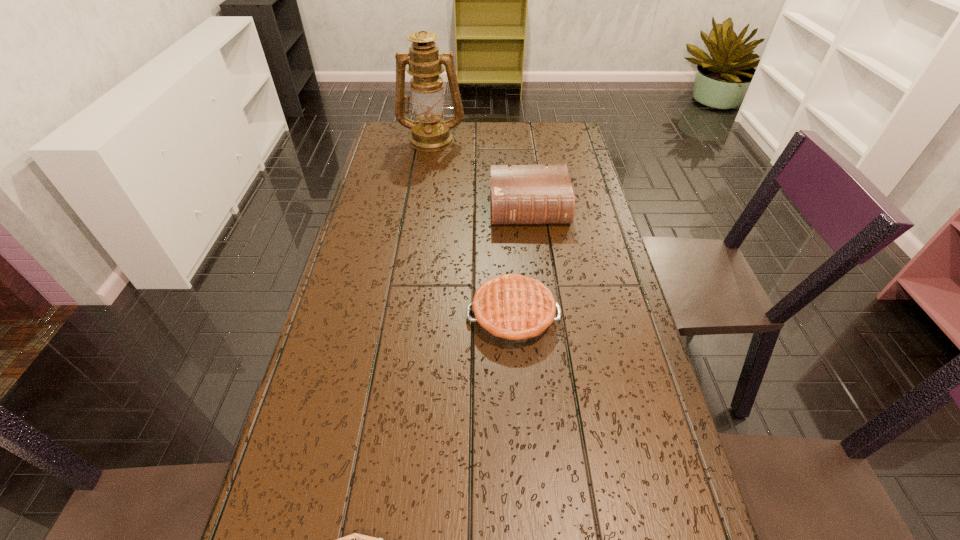
At what (x,y) coordinates should I click in order to perform the action: click on object that is at the left edge. Please return your answer as a coordinate pair (x, y). Looking at the image, I should click on (430, 133).

Locate an element on the screen. object located in the right edge section of the desktop is located at coordinates (520, 194).

Locate an element on the screen. object positioned at the far left corner is located at coordinates (430, 133).

Where is `blank space at the far edge of the desktop`? This screenshot has height=540, width=960. blank space at the far edge of the desktop is located at coordinates (493, 152).

The height and width of the screenshot is (540, 960). Identify the location of free space at the left edge of the desktop. (x=415, y=174).

At what (x,y) coordinates should I click in order to perform the action: click on vacant area at the right edge of the desktop. Please return your answer as a coordinate pair (x, y). The height and width of the screenshot is (540, 960). Looking at the image, I should click on (593, 340).

You are a GUI agent. You are given a task and a screenshot of the screen. Output one action in this format:
    pyautogui.click(x=<x>, y=<y>)
    Task: Click on the vacant space at the far right corner of the desktop
    
    Given the screenshot: What is the action you would take?
    pyautogui.click(x=536, y=129)

The width and height of the screenshot is (960, 540). Identify the location of empty space that is in between the farthest object and the third tallest object. (472, 227).

You are a GUI agent. You are given a task and a screenshot of the screen. Output one action in this format:
    pyautogui.click(x=<x>, y=<y>)
    Task: Click on the free spot between the third farthest object and the farthest object
    
    Given the screenshot: What is the action you would take?
    pyautogui.click(x=472, y=227)

Locate an element on the screen. Image resolution: width=960 pixels, height=540 pixels. empty space that is in between the farthest object and the second shortest object is located at coordinates (472, 227).